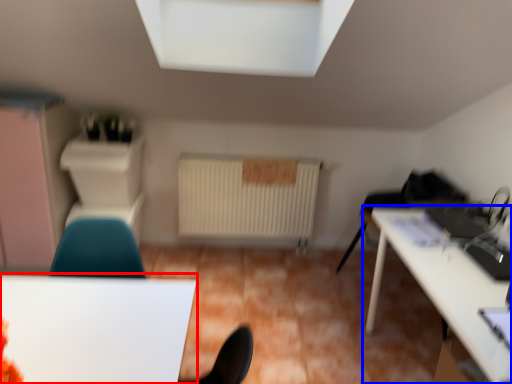
Question: Which of the following is the closest to the observer, table (highlighted by a red box) or table (highlighted by a blue box)?

Choices:
 (A) table
 (B) table

Answer: (A)